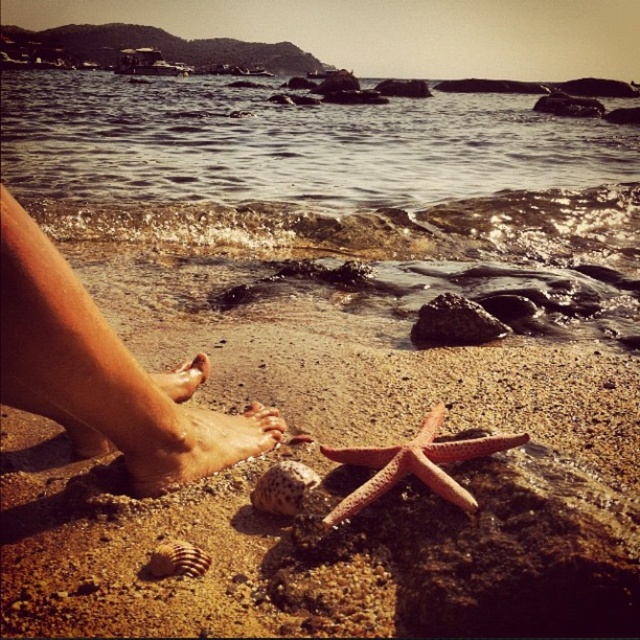
Question: Among these points, which one is nearest to the camera?

Choices:
 (A) (304, 465)
 (B) (465, 449)
 (C) (195, 420)

Answer: (B)

Question: Which point is closer to the camera?

Choices:
 (A) dry skin feet at lower left
 (B) brown skin at lower left
 (C) sandy brown at lower center

Answer: (A)

Question: Considering the relative positions of sandy brown at lower center and pink flesh at lower center in the image provided, where is sandy brown at lower center located with respect to pink flesh at lower center?

Choices:
 (A) below
 (B) above

Answer: (B)

Question: Can you confirm if clear water at lower center is positioned above brown skin at lower left?

Choices:
 (A) no
 (B) yes

Answer: (B)

Question: Based on their relative distances, which object is nearer to the speckled shell at lower center?

Choices:
 (A) brown skin at lower left
 (B) sandy brown at lower center
 (C) clear water at lower center

Answer: (A)

Question: From the image, what is the correct spatial relationship of dry skin feet at lower left in relation to pink matte starfish at center?

Choices:
 (A) above
 (B) below

Answer: (A)